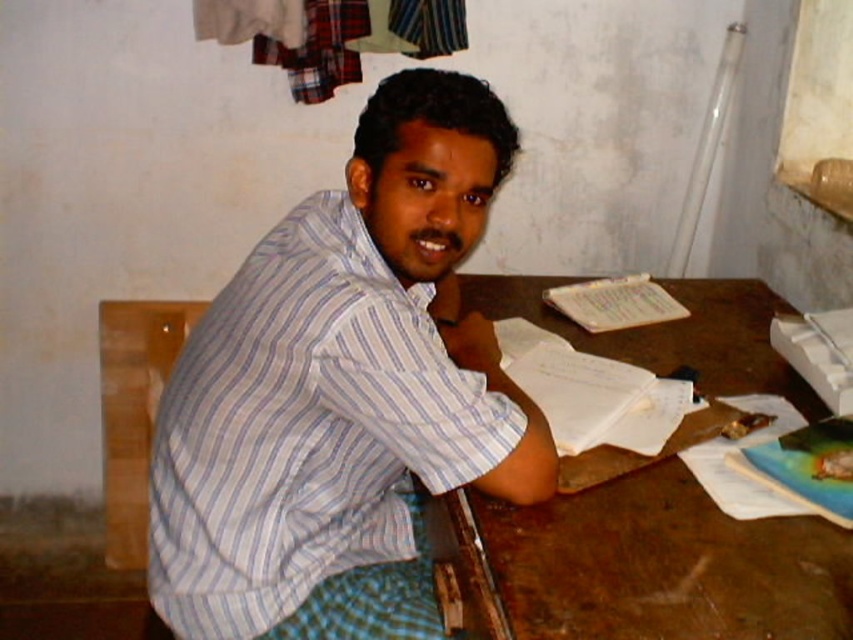
Question: Among these points, which one is farthest from the camera?

Choices:
 (A) coord(165,496)
 (B) coord(633,465)

Answer: (B)

Question: Does white striped shirt at center appear over brown wooden table at center?

Choices:
 (A) yes
 (B) no

Answer: (A)

Question: Considering the relative positions of white striped shirt at center and brown wooden table at center in the image provided, where is white striped shirt at center located with respect to brown wooden table at center?

Choices:
 (A) below
 (B) above

Answer: (B)

Question: Which of the following is the closest to the observer?

Choices:
 (A) white striped shirt at center
 (B) brown wooden table at center

Answer: (B)

Question: Can you confirm if white striped shirt at center is bigger than brown wooden table at center?

Choices:
 (A) yes
 (B) no

Answer: (B)

Question: Which point appears farthest from the camera in this image?

Choices:
 (A) (386, 339)
 (B) (618, 452)

Answer: (B)